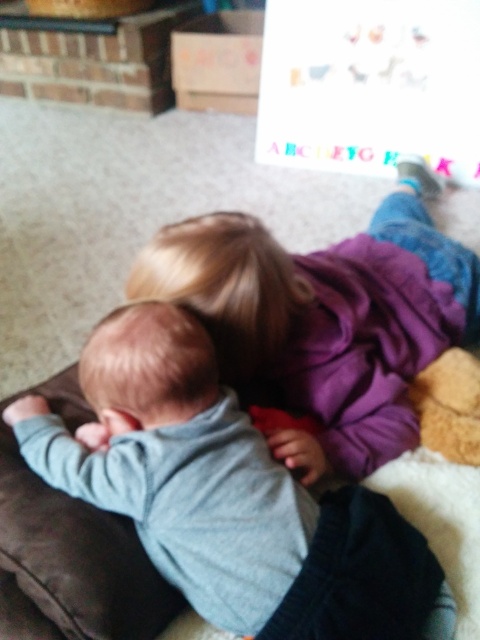
You are a photographer standing 1 meter away from the camera. You want to take a photo of the gray soft baby at upper left. Can you adjust your position so that you are closer to the baby than the camera is?

The gray soft baby at upper left and camera are 69.08 centimeters apart. If you are standing 1 meter away from the camera, your distance to the baby would be 1 meter minus 69.08 centimeters, which is approximately 30.92 centimeters. This means you can move closer to the baby so that you are within 30.92 centimeters from it, which is closer than the camera.

You are a photographer setting up a photo shoot in this living room. You want to capture both the gray soft baby at upper left and the matte purple sweater at upper center in the same frame. Which object should you position closer to the camera to ensure both are fully visible without cropping?

Since the gray soft baby at upper left is narrower than the matte purple sweater at upper center, you should position the matte purple sweater at upper center closer to the camera. This way, the wider object will occupy more space in the frame, allowing both to fit without cropping.

You are a photographer trying to capture a candid shot of the gray soft baby at upper left and the matte purple sweater at upper center. To ensure both subjects are in focus, you need to know their relative positions. Which object is closer to the camera?

The gray soft baby at upper left is closer to the camera because it is in front of the matte purple sweater at upper center.